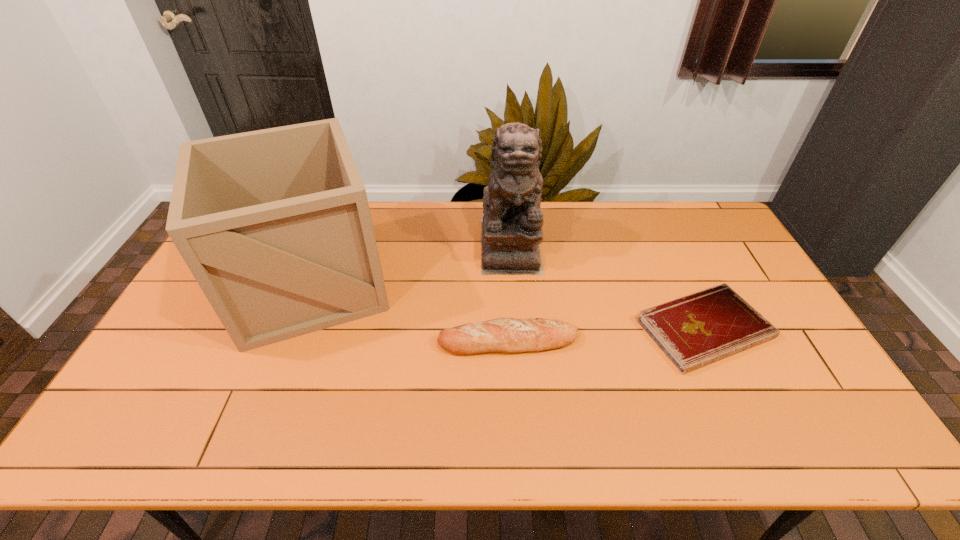
Find the location of `sculpture`. sculpture is located at coordinates (512, 222).

You are a GUI agent. You are given a task and a screenshot of the screen. Output one action in this format:
    pyautogui.click(x=<x>, y=<y>)
    Task: Click on the box
    The image size is (960, 540).
    Given the screenshot: What is the action you would take?
    pyautogui.click(x=274, y=224)

You are a GUI agent. You are given a task and a screenshot of the screen. Output one action in this format:
    pyautogui.click(x=<x>, y=<y>)
    Task: Click on the baguet
    The image size is (960, 540).
    Given the screenshot: What is the action you would take?
    pyautogui.click(x=503, y=335)

Find the location of a particular element. notebook is located at coordinates (696, 330).

I want to click on the rightmost object, so click(696, 330).

Locate an element on the screen. This screenshot has height=540, width=960. vacant space located 0.250m on the front-facing side of the sculpture is located at coordinates 517,338.

At what (x,y) coordinates should I click in order to perform the action: click on free space located 0.260m on the front of the leftmost object. Please return your answer as a coordinate pair (x, y). The width and height of the screenshot is (960, 540). Looking at the image, I should click on (245, 446).

At what (x,y) coordinates should I click in order to perform the action: click on vacant space located 0.110m on the right of the second shortest object. Please return your answer as a coordinate pair (x, y). The width and height of the screenshot is (960, 540). Looking at the image, I should click on (617, 341).

The width and height of the screenshot is (960, 540). I want to click on free spot located on the back of the shortest object, so (x=672, y=260).

Locate an element on the screen. The width and height of the screenshot is (960, 540). sculpture that is at the far edge is located at coordinates (512, 222).